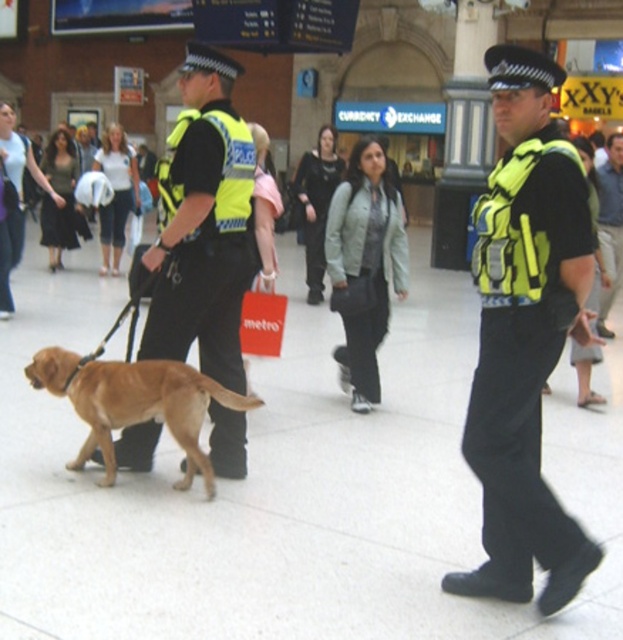
Does reflective yellow vest at center appear on the right side of golden fur dog at center?

Yes, reflective yellow vest at center is to the right of golden fur dog at center.

How far apart are reflective yellow vest at center and golden fur dog at center?

reflective yellow vest at center is 19.33 inches away from golden fur dog at center.

Identify the location of reflective yellow vest at center. (202, 227).

Is reflective yellow vest at center positioned behind dark green fabric shirt at center?

No, it is in front of dark green fabric shirt at center.

Does point (193, 227) lie behind point (609, 196)?

No, it is not.

Image resolution: width=623 pixels, height=640 pixels. Find the location of `reflective yellow vest at center`. reflective yellow vest at center is located at coordinates point(202,227).

Locate an element on the screen. The height and width of the screenshot is (640, 623). golden fur dog at center is located at coordinates (135, 403).

Find the location of a particular element. golden fur dog at center is located at coordinates (135, 403).

You are a GUI agent. You are given a task and a screenshot of the screen. Output one action in this format:
    pyautogui.click(x=<x>, y=<y>)
    Task: Click on the golden fur dog at center
    The height and width of the screenshot is (640, 623).
    Given the screenshot: What is the action you would take?
    pyautogui.click(x=135, y=403)